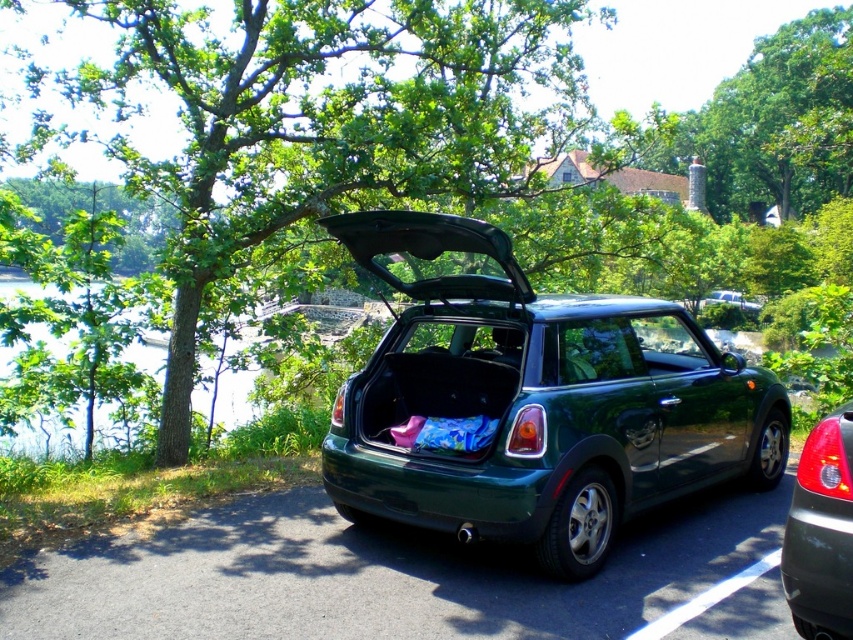
Is green matte car trunk at center shorter than green matte car at center?

No, green matte car trunk at center is not shorter than green matte car at center.

You are a GUI agent. You are given a task and a screenshot of the screen. Output one action in this format:
    pyautogui.click(x=<x>, y=<y>)
    Task: Click on the green matte car trunk at center
    This screenshot has height=640, width=853.
    Given the screenshot: What is the action you would take?
    pyautogui.click(x=534, y=403)

This screenshot has width=853, height=640. I want to click on green matte car trunk at center, so click(x=534, y=403).

Does green leafy tree at upper left appear under green matte car at center?

Incorrect, green leafy tree at upper left is not positioned below green matte car at center.

Between green leafy tree at upper left and green matte car at center, which one has more height?

Standing taller between the two is green leafy tree at upper left.

Does point (552, 45) come closer to viewer compared to point (807, 563)?

That is False.

This screenshot has width=853, height=640. Find the location of `green leafy tree at upper left`. green leafy tree at upper left is located at coordinates (323, 124).

Is green leafy tree at upper left taller than green matte car trunk at center?

Indeed, green leafy tree at upper left has a greater height compared to green matte car trunk at center.

Does green leafy tree at upper left have a larger size compared to green matte car trunk at center?

Indeed, green leafy tree at upper left has a larger size compared to green matte car trunk at center.

Measure the distance between point (555, 28) and camera.

The distance of point (555, 28) from camera is 39.31 meters.

Find the location of a particular element. green leafy tree at upper left is located at coordinates (323, 124).